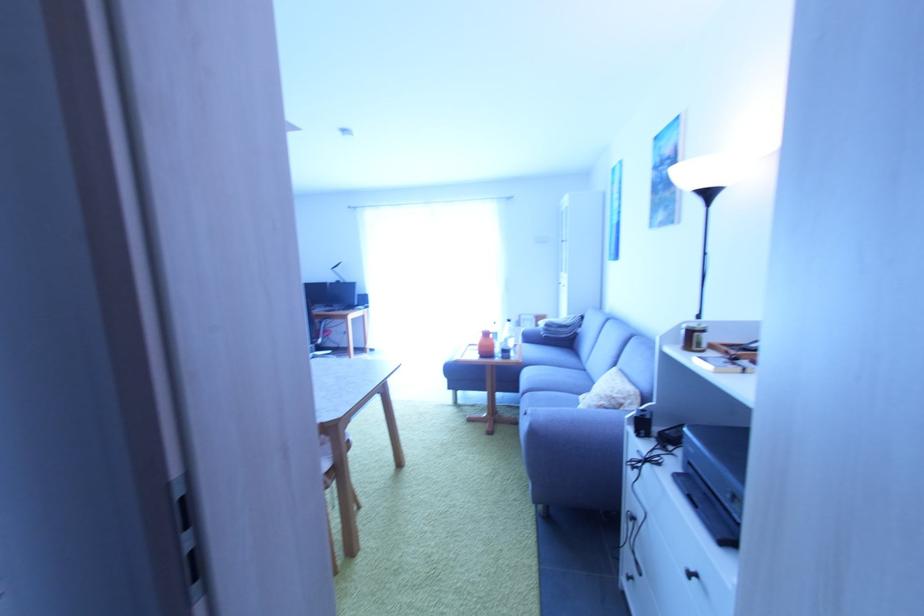
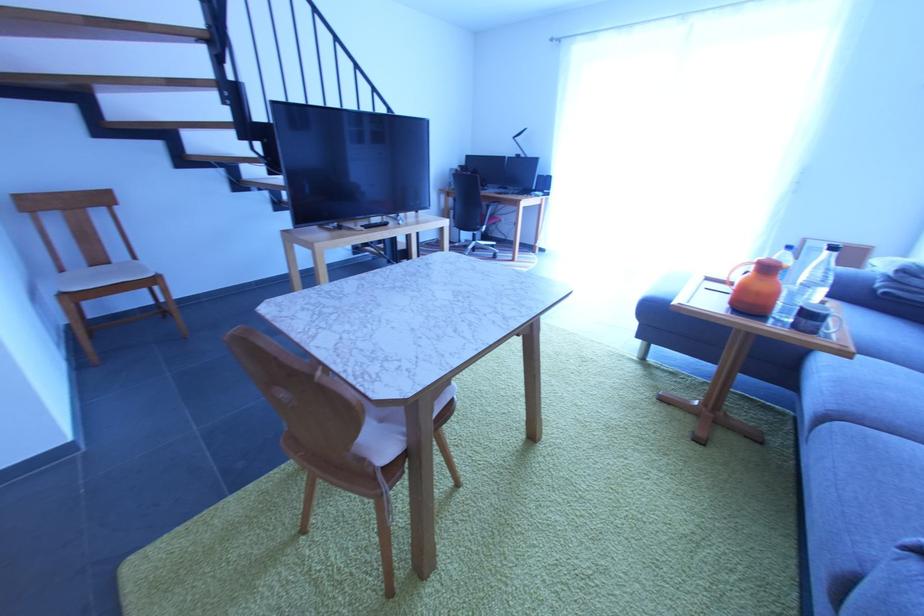
Question: I am providing you with two images of the same scene from different viewpoints. Please identify which objects are invisible in image2.

Choices:
 (A) black bottle cap
 (B) blue sofa sitting surface
 (C) blue bottle cap
 (D) none of these

Answer: (D)